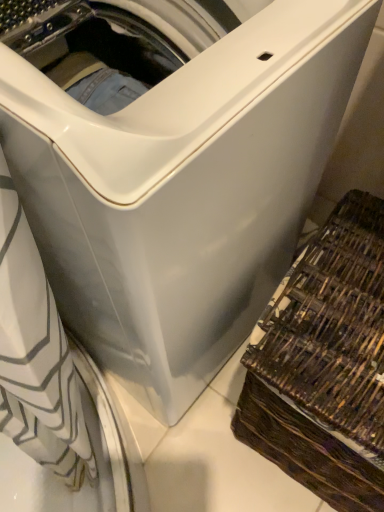
What is the approximate height of woven brown basket at lower right?

It is 20.17 inches.

Identify the location of woven brown basket at lower right. Image resolution: width=384 pixels, height=512 pixels. (324, 362).

Describe the element at coordinates (324, 362) in the screenshot. I see `woven brown basket at lower right` at that location.

Find the location of a particular element. woven brown basket at lower right is located at coordinates (324, 362).